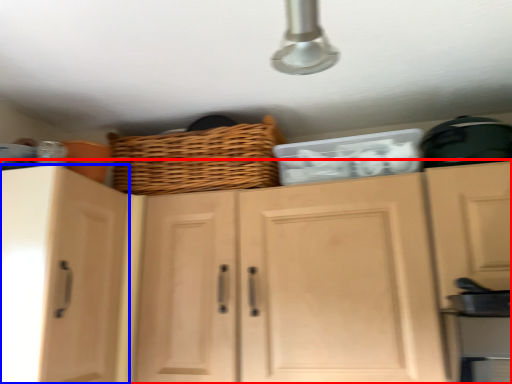
Question: Which object is further to the camera taking this photo, cabinetry (highlighted by a red box) or cabinetry (highlighted by a blue box)?

Choices:
 (A) cabinetry
 (B) cabinetry

Answer: (B)